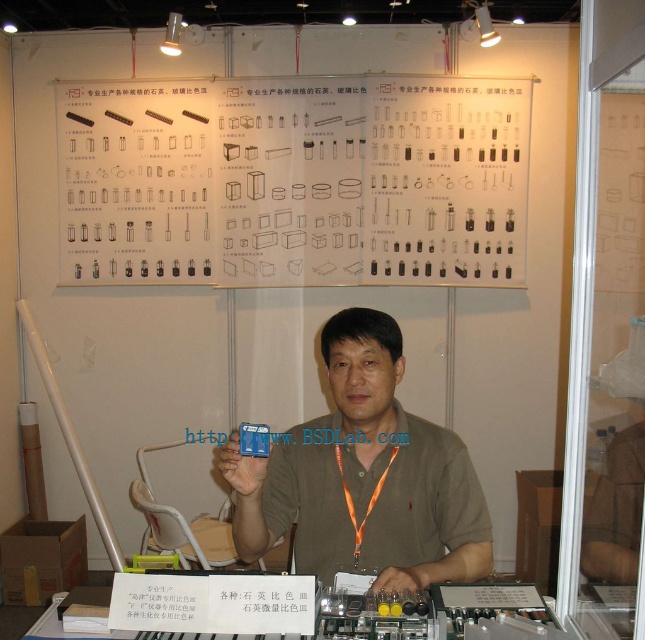
Which is behind, point (104, 202) or point (561, 637)?

The point (104, 202) is more distant.

Is point (66, 260) positioned behind point (372, 618)?

That is True.

Does point (81, 192) lie behind point (215, 588)?

Yes.

Image resolution: width=645 pixels, height=640 pixels. Find the location of `white paper at upper center`. white paper at upper center is located at coordinates (293, 180).

Is white paper at upper center smaller than matte blue card at center?

No, white paper at upper center is not smaller than matte blue card at center.

Does white paper at upper center come in front of matte blue card at center?

No, white paper at upper center is behind matte blue card at center.

Is point (397, 234) in front of point (470, 516)?

No, (397, 234) is further to viewer.

The image size is (645, 640). Identify the location of white paper at upper center. (293, 180).

Which is behind, point (321, 554) or point (134, 593)?

Positioned behind is point (321, 554).

How distant is matte blue card at center from translucent plastic tubes at lower center?

matte blue card at center and translucent plastic tubes at lower center are 9.85 inches apart.

Who is more distant from viewer, (384, 508) or (121, 624)?

The point (384, 508) is more distant.

At what (x,y) coordinates should I click in order to perform the action: click on matte blue card at center. Please return your answer as a coordinate pair (x, y). Looking at the image, I should click on (364, 476).